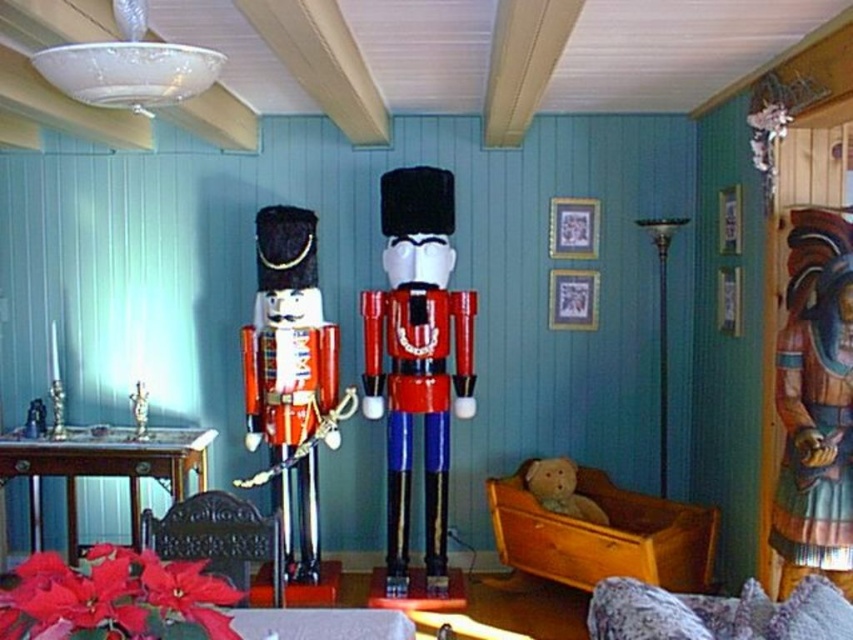
You are standing in the room and want to place a gift box on the smooth wooden table at center. To do so, do you need to move around the shiny red wood nutcracker at left?

The smooth wooden table at center is behind the shiny red wood nutcracker at left, so you would need to move around the shiny red wood nutcracker at left to access the smooth wooden table at center and place the gift box there.

You are arranging a Christmas display and need to place the shiny red poinsettia at lower left and the metallic silver figurine at center. According to the scene, which object is located to the right of the other?

The shiny red poinsettia at lower left is positioned on the right side of metallic silver figurine at center, so the poinsettia is to the right of the metallic silver figurine at center.

You are standing in the center of the room and want to place a small gift box on the table to the left of the glossy painted wood nutcracker at center. Can you walk directly to the table without moving the nutcracker?

The glossy painted wood nutcracker at center is located at point (416, 358), so you can walk directly to the table to its left without needing to move the nutcracker.